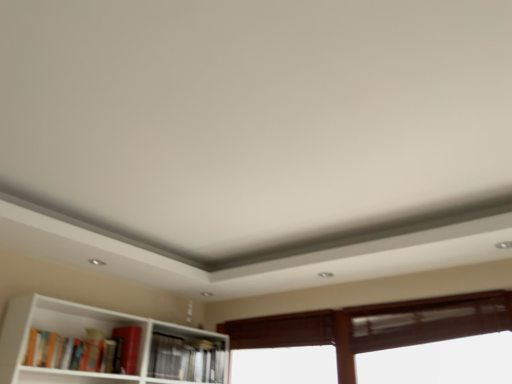
Question: Considering the relative sizes of hardcover book at center, the 1th book positioned from the back, and brown wooden window at lower right in the image provided, is hardcover book at center, the 1th book positioned from the back, wider than brown wooden window at lower right?

Choices:
 (A) yes
 (B) no

Answer: (B)

Question: Is hardcover book at center, acting as the 1th book starting from the right, turned away from brown wooden window at lower right?

Choices:
 (A) yes
 (B) no

Answer: (B)

Question: From the image's perspective, does hardcover book at center, arranged as the 2th book when viewed from the left, appear lower than brown wooden window at lower right?

Choices:
 (A) yes
 (B) no

Answer: (A)

Question: Considering the relative sizes of hardcover book at center, the 2th book from the front, and brown wooden window at lower right in the image provided, is hardcover book at center, the 2th book from the front, taller than brown wooden window at lower right?

Choices:
 (A) no
 (B) yes

Answer: (A)

Question: From a real-world perspective, is hardcover book at center, the 1th book positioned from the back, physically below brown wooden window at lower right?

Choices:
 (A) no
 (B) yes

Answer: (B)

Question: Is hardcover book at center, the 2th book from the front, touching brown wooden window at lower right?

Choices:
 (A) yes
 (B) no

Answer: (B)

Question: Is hardcover book at lower left, which is the 1th book from front to back, a part of hardcover book at center, the 1th book positioned from the back?

Choices:
 (A) no
 (B) yes

Answer: (A)

Question: Is hardcover book at center, the 2th book from the front, smaller than hardcover book at lower left, which is the first book in left-to-right order?

Choices:
 (A) yes
 (B) no

Answer: (A)

Question: From the image's perspective, is hardcover book at center, the 2th book from the front, below hardcover book at lower left, which is the first book in left-to-right order?

Choices:
 (A) no
 (B) yes

Answer: (B)

Question: Is hardcover book at center, the 1th book positioned from the back, oriented towards hardcover book at lower left, which is the first book in left-to-right order?

Choices:
 (A) yes
 (B) no

Answer: (B)

Question: Is hardcover book at center, the 2th book from the front, taller than hardcover book at lower left, which is the first book in left-to-right order?

Choices:
 (A) yes
 (B) no

Answer: (A)

Question: Can you confirm if hardcover book at center, acting as the 1th book starting from the right, is positioned to the left of hardcover book at lower left, the 2th book viewed from the back?

Choices:
 (A) yes
 (B) no

Answer: (B)

Question: Considering the relative sizes of hardcover book at lower left, which is the 1th book from front to back, and hardcover book at center, arranged as the 2th book when viewed from the left, in the image provided, is hardcover book at lower left, which is the 1th book from front to back, smaller than hardcover book at center, arranged as the 2th book when viewed from the left,?

Choices:
 (A) no
 (B) yes

Answer: (A)